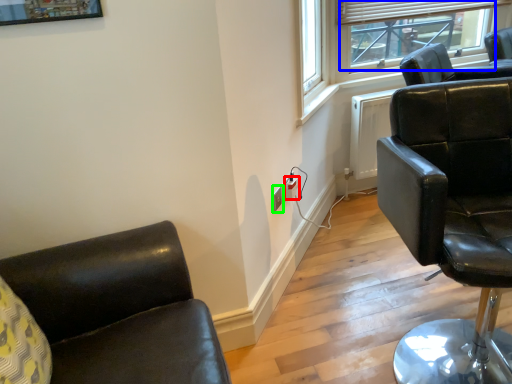
Question: Based on their relative distances, which object is nearer to electric outlet (highlighted by a red box)? Choose from window screen (highlighted by a blue box) and electric outlet (highlighted by a green box).

Choices:
 (A) window screen
 (B) electric outlet

Answer: (B)